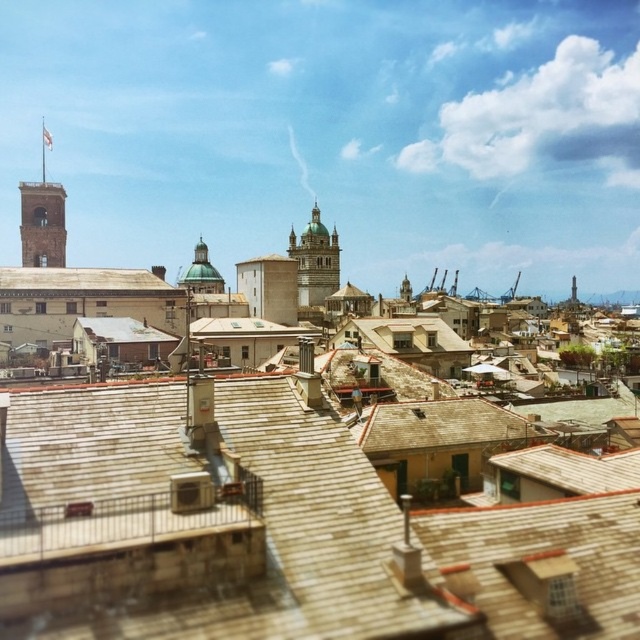
Question: Which of these objects is positioned farthest from the brown shingles at center?

Choices:
 (A) golden stone bell tower at center
 (B) brick bell tower at left

Answer: (A)

Question: Which point appears closest to the camera in this image?

Choices:
 (A) [x=28, y=228]
 (B) [x=314, y=269]
 (C) [x=65, y=284]

Answer: (C)

Question: Does brown shingles at center have a smaller size compared to golden stone bell tower at center?

Choices:
 (A) no
 (B) yes

Answer: (B)

Question: Which object is positioned closest to the brown shingles at center?

Choices:
 (A) golden stone bell tower at center
 (B) brick bell tower at left

Answer: (B)

Question: Is brown shingles at center above golden stone bell tower at center?

Choices:
 (A) no
 (B) yes

Answer: (A)

Question: Does brown shingles at center have a larger size compared to brick bell tower at left?

Choices:
 (A) no
 (B) yes

Answer: (B)